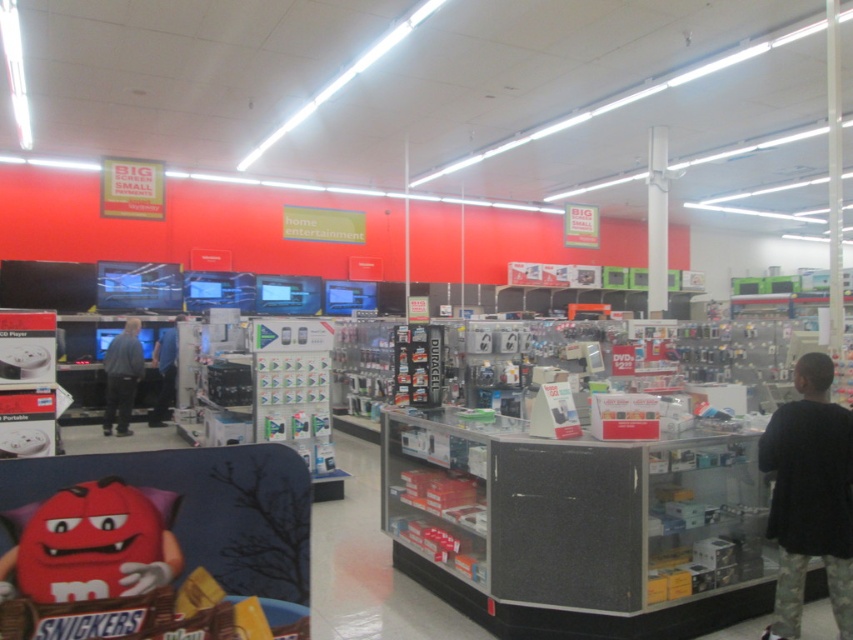
Question: Which point appears closest to the camera in this image?

Choices:
 (A) (51, 532)
 (B) (796, 518)
 (C) (125, 380)

Answer: (A)

Question: Among these objects, which one is nearest to the camera?

Choices:
 (A) black matte shirt at right
 (B) dark blue jeans at center
 (C) blue fabric shirt at left

Answer: (A)

Question: Which of the following is the closest to the observer?

Choices:
 (A) matte plastic m&m's character at lower left
 (B) black matte shirt at right

Answer: (A)

Question: Observing the image, what is the correct spatial positioning of black matte shirt at right in reference to matte plastic m&m's character at lower left?

Choices:
 (A) above
 (B) below

Answer: (B)

Question: Can you confirm if black matte shirt at right is positioned below blue fabric shirt at left?

Choices:
 (A) yes
 (B) no

Answer: (A)

Question: Considering the relative positions of black matte shirt at right and blue fabric shirt at left in the image provided, where is black matte shirt at right located with respect to blue fabric shirt at left?

Choices:
 (A) below
 (B) above

Answer: (A)